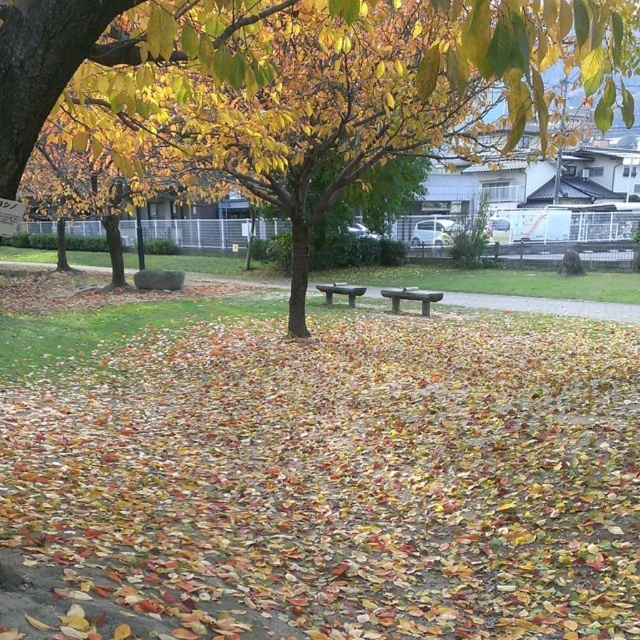
Question: Which point appears closest to the camera in this image?

Choices:
 (A) (424, 339)
 (B) (332, 289)

Answer: (A)

Question: Is yellow-green leaves at upper center closer to the viewer compared to green stone bench at center?

Choices:
 (A) yes
 (B) no

Answer: (A)

Question: Observing the image, what is the correct spatial positioning of yellow-green leaves at upper center in reference to green stone bench at center?

Choices:
 (A) right
 (B) left

Answer: (A)

Question: Among these points, which one is nearest to the camera?

Choices:
 (A) (131, 70)
 (B) (632, 452)
 (C) (413, 291)
 (D) (330, 298)

Answer: (A)

Question: Can you confirm if yellow-green leaves at upper center is positioned below smooth gray bench at center?

Choices:
 (A) no
 (B) yes

Answer: (A)

Question: Which object appears closest to the camera in this image?

Choices:
 (A) green stone bench at center
 (B) yellow-green leaves at upper center

Answer: (B)